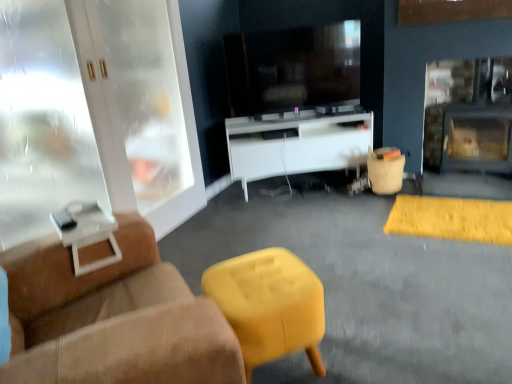
This screenshot has width=512, height=384. I want to click on empty space that is ontop of matte yellow stool at center, the 2th bar stool viewed from the right, so click(x=259, y=282).